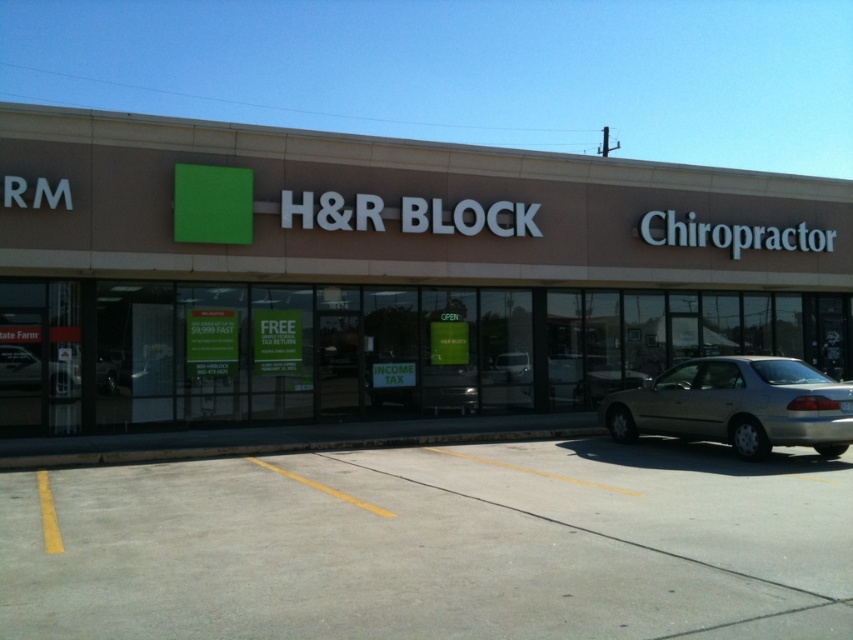
Question: Which object appears closest to the camera in this image?

Choices:
 (A) gray concrete parking lot at lower center
 (B) gold metallic sedan at lower right
 (C) brown matte building at center

Answer: (A)

Question: In this image, where is gray concrete parking lot at lower center located relative to gold metallic sedan at lower right?

Choices:
 (A) below
 (B) above

Answer: (A)

Question: Which of the following is the closest to the observer?

Choices:
 (A) (718, 435)
 (B) (73, 589)

Answer: (B)

Question: Can you confirm if brown matte building at center is wider than gray concrete parking lot at lower center?

Choices:
 (A) yes
 (B) no

Answer: (A)

Question: Does brown matte building at center appear over gray concrete parking lot at lower center?

Choices:
 (A) yes
 (B) no

Answer: (A)

Question: Estimate the real-world distances between objects in this image. Which object is closer to the brown matte building at center?

Choices:
 (A) gray concrete parking lot at lower center
 (B) gold metallic sedan at lower right

Answer: (B)